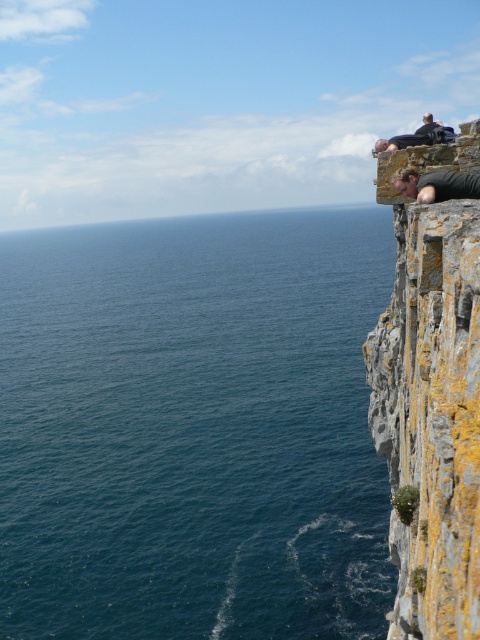
You are standing at the point labeled point (x=471, y=182) on a cliff overlooking the ocean. You want to move to the point labeled point (x=368, y=276). According to the scene, is the destination point behind or in front of your current position?

The point (x=368, y=276) is behind point (x=471, y=182), so the destination point is behind your current position.